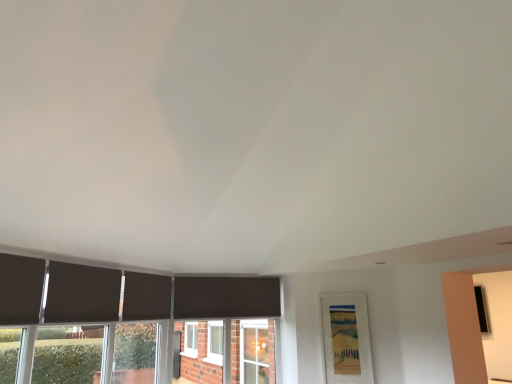
Question: Is dark matte curtain at lower left, acting as the second curtain starting from the left, to the left of dark matte curtain at left, the first curtain viewed from the front, from the viewer's perspective?

Choices:
 (A) yes
 (B) no

Answer: (B)

Question: Does dark matte curtain at lower left, the second curtain positioned from the front, have a smaller size compared to dark matte curtain at left, the first curtain viewed from the front?

Choices:
 (A) no
 (B) yes

Answer: (A)

Question: Does dark matte curtain at lower left, arranged as the 2th curtain when viewed from the right, come behind dark matte curtain at left, arranged as the 1th curtain when viewed from the left?

Choices:
 (A) yes
 (B) no

Answer: (A)

Question: From a real-world perspective, is dark matte curtain at lower left, acting as the second curtain starting from the left, under dark matte curtain at left, which is counted as the third curtain, starting from the back?

Choices:
 (A) yes
 (B) no

Answer: (B)

Question: From a real-world perspective, is dark matte curtain at lower left, arranged as the 2th curtain when viewed from the right, on dark matte curtain at left, which is counted as the third curtain, starting from the back?

Choices:
 (A) no
 (B) yes

Answer: (B)

Question: From the image's perspective, is dark matte curtain at left, arranged as the 1th curtain when viewed from the left, located above or below matte black curtain at center, the third curtain viewed from the front?

Choices:
 (A) above
 (B) below

Answer: (A)

Question: Based on their positions, is dark matte curtain at left, the 3th curtain in the right-to-left sequence, located to the left or right of matte black curtain at center, the third curtain viewed from the front?

Choices:
 (A) right
 (B) left

Answer: (B)

Question: Is point (15, 269) closer or farther from the camera than point (156, 278)?

Choices:
 (A) farther
 (B) closer

Answer: (B)

Question: Looking at their shapes, would you say dark matte curtain at left, which is counted as the third curtain, starting from the back, is wider or thinner than matte black curtain at center, the third curtain viewed from the front?

Choices:
 (A) wide
 (B) thin

Answer: (B)

Question: Based on their positions, is dark matte curtain at lower left, acting as the second curtain starting from the left, located to the left or right of matte black curtain at center, the third curtain viewed from the front?

Choices:
 (A) right
 (B) left

Answer: (B)

Question: Considering their positions, is dark matte curtain at lower left, which is counted as the 2th curtain, starting from the back, located in front of or behind matte black curtain at center, the first curtain viewed from the right?

Choices:
 (A) front
 (B) behind

Answer: (A)

Question: From a real-world perspective, relative to matte black curtain at center, the 3th curtain viewed from the left, is dark matte curtain at lower left, which is counted as the 2th curtain, starting from the back, vertically above or below?

Choices:
 (A) above
 (B) below

Answer: (B)

Question: Is point (65, 299) closer or farther from the camera than point (141, 299)?

Choices:
 (A) closer
 (B) farther

Answer: (A)

Question: In the image, is dark matte curtain at lower left, arranged as the 2th curtain when viewed from the right, positioned in front of or behind dark matte curtain at left, the first curtain viewed from the front?

Choices:
 (A) front
 (B) behind

Answer: (B)

Question: Is dark matte curtain at lower left, which is counted as the 2th curtain, starting from the back, inside the boundaries of dark matte curtain at left, which is counted as the third curtain, starting from the back, or outside?

Choices:
 (A) inside
 (B) outside

Answer: (B)